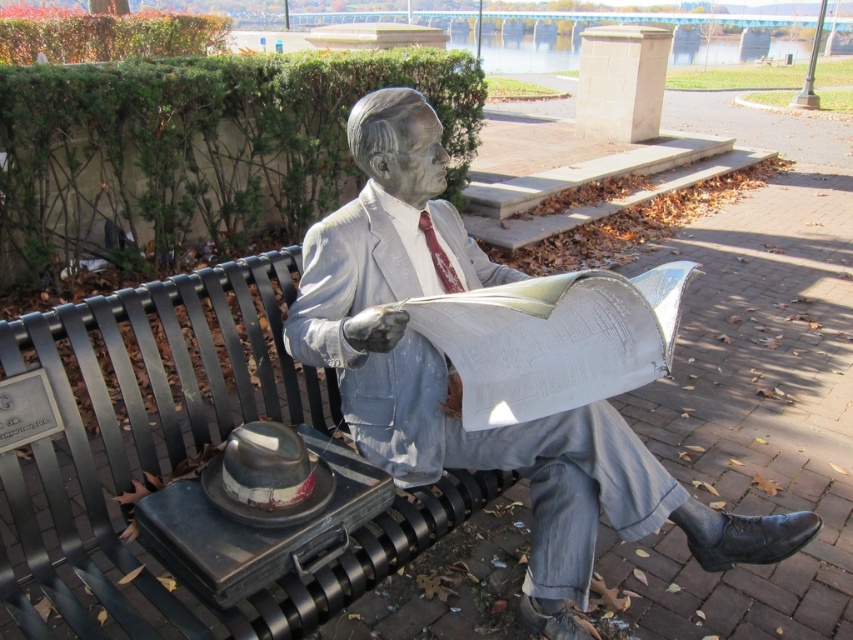
Question: Does gray stone statue at center appear over shiny metallic hat at lower left?

Choices:
 (A) no
 (B) yes

Answer: (B)

Question: Can you confirm if gray stone statue at center is bigger than shiny metallic hat at lower left?

Choices:
 (A) no
 (B) yes

Answer: (B)

Question: Which object is closer to the camera taking this photo?

Choices:
 (A) shiny metallic hat at lower left
 (B) gray stone statue at center

Answer: (A)

Question: Which point is closer to the camera?

Choices:
 (A) (451, 388)
 (B) (318, 480)

Answer: (B)

Question: Does gray stone statue at center come in front of shiny metallic hat at lower left?

Choices:
 (A) no
 (B) yes

Answer: (A)